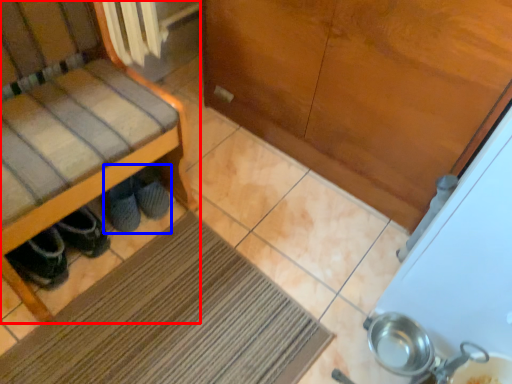
Question: Which of the following is the closest to the observer, furniture (highlighted by a red box) or footwear (highlighted by a blue box)?

Choices:
 (A) furniture
 (B) footwear

Answer: (A)